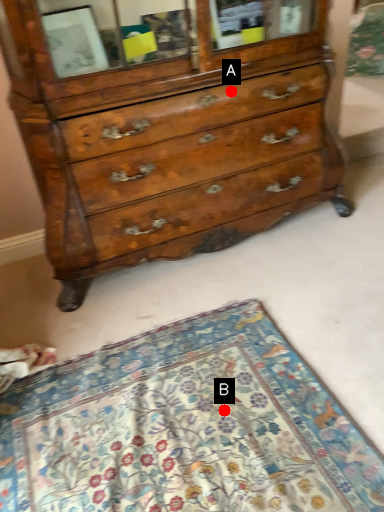
Question: Two points are circled on the image, labeled by A and B beside each circle. Which point appears closest to the camera in this image?

Choices:
 (A) A is closer
 (B) B is closer

Answer: (B)